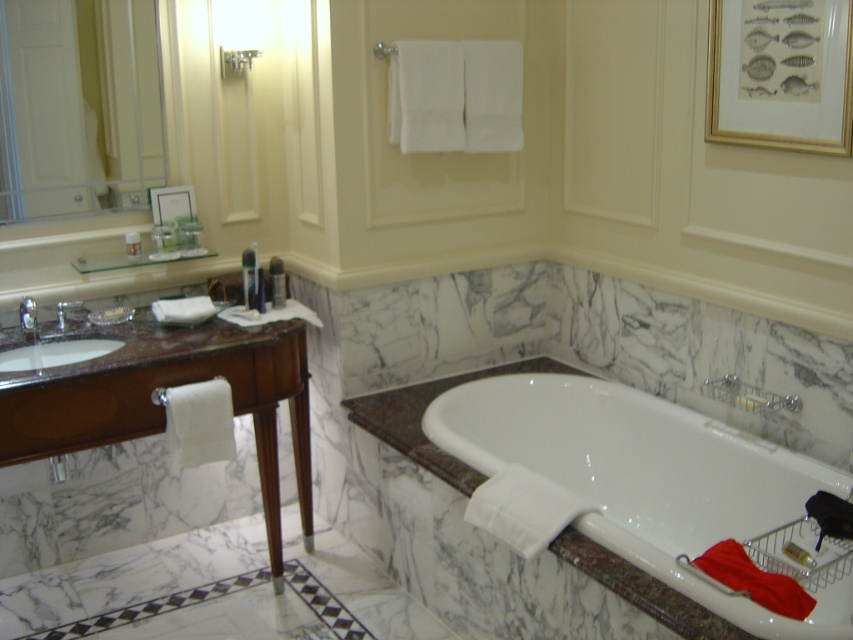
Who is more forward, (505,472) or (241,54)?

Point (505,472)

At what (x,y) coordinates should I click in order to perform the action: click on white glossy bathtub at center. Please return your answer as a coordinate pair (x, y). The image size is (853, 640). Looking at the image, I should click on (631, 483).

At what (x,y) coordinates should I click in order to perform the action: click on white glossy bathtub at center. Please return your answer as a coordinate pair (x, y). The image size is (853, 640). Looking at the image, I should click on (631, 483).

Does brown polished wood vanity at left appear on the right side of white marble shower at upper center?

Incorrect, brown polished wood vanity at left is not on the right side of white marble shower at upper center.

What do you see at coordinates (157, 396) in the screenshot?
I see `brown polished wood vanity at left` at bounding box center [157, 396].

The image size is (853, 640). What do you see at coordinates (157, 396) in the screenshot?
I see `brown polished wood vanity at left` at bounding box center [157, 396].

Where is `brown polished wood vanity at left`? This screenshot has width=853, height=640. brown polished wood vanity at left is located at coordinates click(157, 396).

Is point (271, 404) more distant than point (83, 340)?

Yes, it is.

In the scene shown: Is brown polished wood vanity at left closer to the viewer compared to white glossy sink at left?

Yes, brown polished wood vanity at left is in front of white glossy sink at left.

Between point (157, 372) and point (10, 349), which one is positioned behind?

The point (10, 349) is more distant.

I want to click on brown polished wood vanity at left, so click(157, 396).